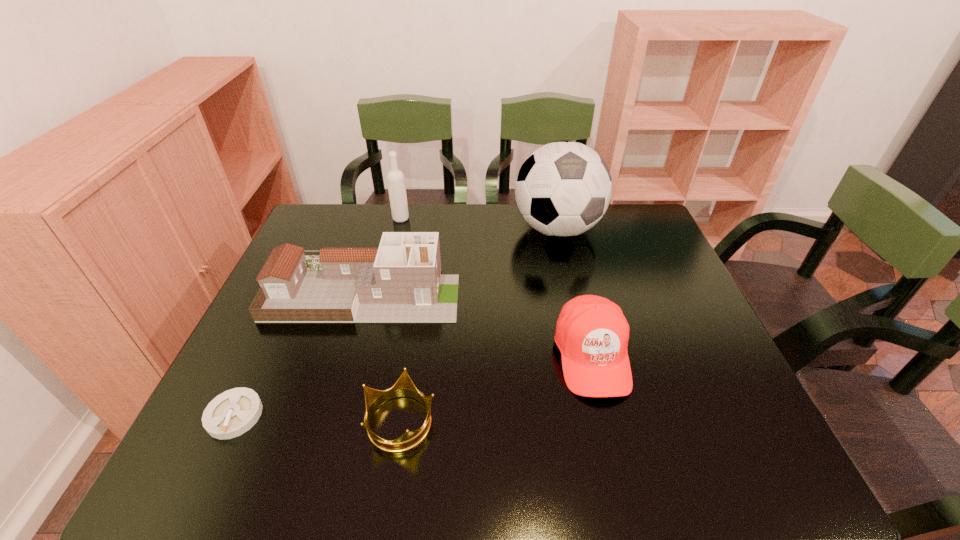
Where is `soccer ball`? soccer ball is located at coordinates (563, 189).

You are a GUI agent. You are given a task and a screenshot of the screen. Output one action in this format:
    pyautogui.click(x=<x>, y=<y>)
    Task: Click on the vodka
    
    Given the screenshot: What is the action you would take?
    pyautogui.click(x=395, y=178)

What are the coordinates of `dollhouse` in the screenshot? It's located at (400, 282).

Locate an element on the screen. The height and width of the screenshot is (540, 960). baseball cap is located at coordinates (592, 334).

Image resolution: width=960 pixels, height=540 pixels. I want to click on the second shortest object, so click(404, 387).

Locate an element on the screen. ashtray is located at coordinates (232, 413).

The height and width of the screenshot is (540, 960). I want to click on vacant space positioned on the main logo of the soccer ball, so click(566, 269).

Find the location of a particular element. This screenshot has height=540, width=960. free space located on the front of the second tallest object is located at coordinates (395, 245).

The width and height of the screenshot is (960, 540). In order to click on vacant space located 0.200m at the main entrance of the fourth shortest object in this screenshot , I will do `click(531, 294)`.

This screenshot has width=960, height=540. Find the location of `vacant space located on the front panel of the third shortest object`. vacant space located on the front panel of the third shortest object is located at coordinates (621, 478).